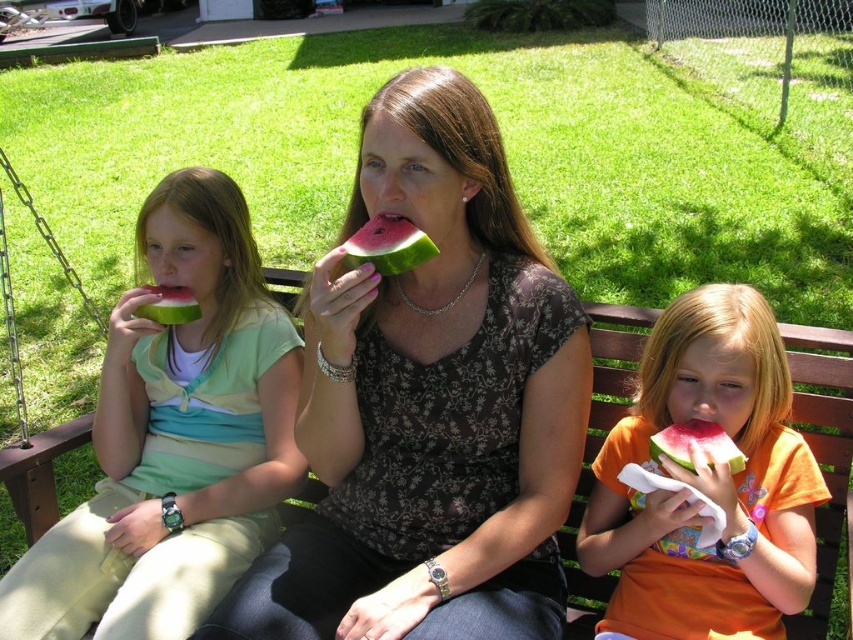
Does orange cotton shirt at center have a larger size compared to green matte watermelon at left?

Correct, orange cotton shirt at center is larger in size than green matte watermelon at left.

The height and width of the screenshot is (640, 853). What do you see at coordinates (706, 483) in the screenshot?
I see `orange cotton shirt at center` at bounding box center [706, 483].

The width and height of the screenshot is (853, 640). Identify the location of orange cotton shirt at center. (706, 483).

Can you confirm if light green fabric shirt at left is positioned to the left of watermelon at center?

Correct, you'll find light green fabric shirt at left to the left of watermelon at center.

Where is `light green fabric shirt at left`? The image size is (853, 640). light green fabric shirt at left is located at coordinates (173, 436).

At what (x,y) coordinates should I click in order to perform the action: click on light green fabric shirt at left. Please return your answer as a coordinate pair (x, y). Looking at the image, I should click on (173, 436).

Does pink flesh watermelon at lower right appear on the right side of green matte watermelon at left?

Correct, you'll find pink flesh watermelon at lower right to the right of green matte watermelon at left.

The width and height of the screenshot is (853, 640). Find the location of `pink flesh watermelon at lower right`. pink flesh watermelon at lower right is located at coordinates (695, 444).

Measure the distance between point (x=654, y=444) and camera.

The distance of point (x=654, y=444) from camera is 4.77 feet.

This screenshot has width=853, height=640. What are the coordinates of `pink flesh watermelon at lower right` in the screenshot? It's located at (695, 444).